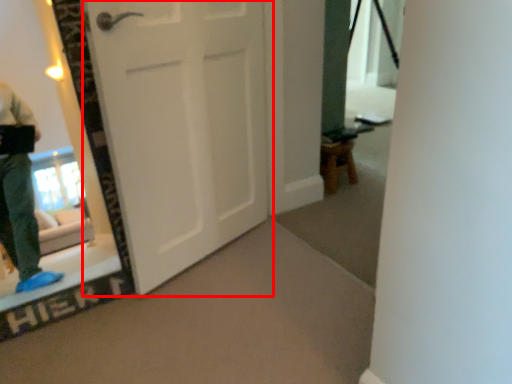
Question: From the image's perspective, considering the relative positions of door (annotated by the red box) and furniture in the image provided, where is door (annotated by the red box) located with respect to the staircase?

Choices:
 (A) below
 (B) above

Answer: (A)